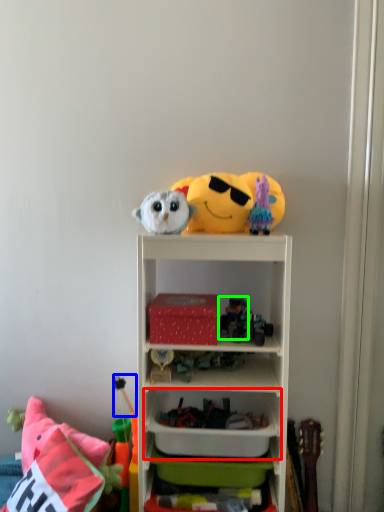
Question: Which object is the closest to the cabinet (highlighted by a red box)? Choose among these: toy (highlighted by a blue box) or toy (highlighted by a green box).

Choices:
 (A) toy
 (B) toy

Answer: (A)